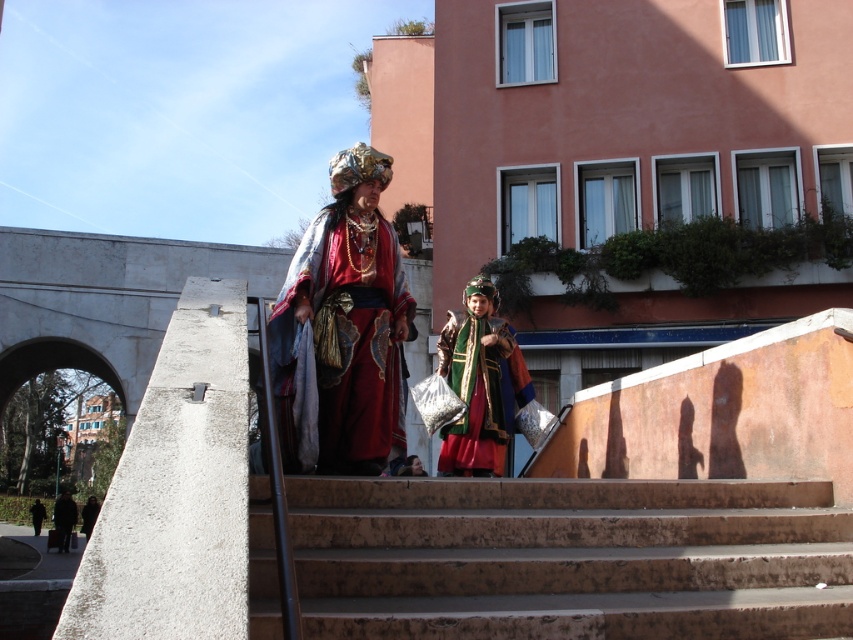
You are a photographer trying to capture a photo of the velvet red robe at center and the brown concrete stairs at center. Since you want to focus on the robe, which object should you position closer to the camera?

You should position the velvet red robe at center closer to the camera because the brown concrete stairs at center has a lesser height compared to velvet red robe at center, making the robe appear larger when closer.

You are a photographer wanting to capture both the velvet red robe at center and the velvet green coat at center in a single frame. Which costume should you focus on first to ensure it appears larger in the photo?

The velvet red robe at center is much taller than the velvet green coat at center, so focusing on the velvet red robe at center first will ensure it appears larger in the photo.

You are standing at the base of the stairs where the two costumed individuals are descending. You need to reach a point that is exactly 10 feet away from your current position. Can you determine if the point labeled as point (x=258, y=476) is within your target distance?

The point labeled as point (x=258, y=476) is 13.25 feet away from your current position, which is further than the 10 feet target distance. Therefore, it is not within the desired range.